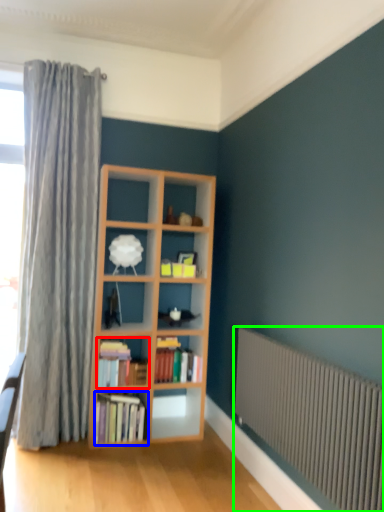
Question: Which object is the closest to the book (highlighted by a red box)? Choose among these: book (highlighted by a blue box) or radiator (highlighted by a green box).

Choices:
 (A) book
 (B) radiator

Answer: (A)